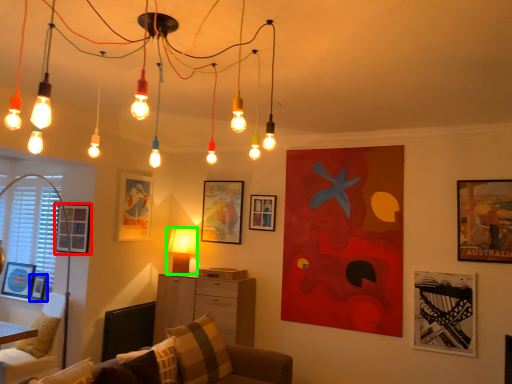
Question: Estimate the real-world distances between objects in this image. Which object is farther from picture frame (highlighted by a red box), picture frame (highlighted by a blue box) or lamp (highlighted by a green box)?

Choices:
 (A) picture frame
 (B) lamp

Answer: (B)